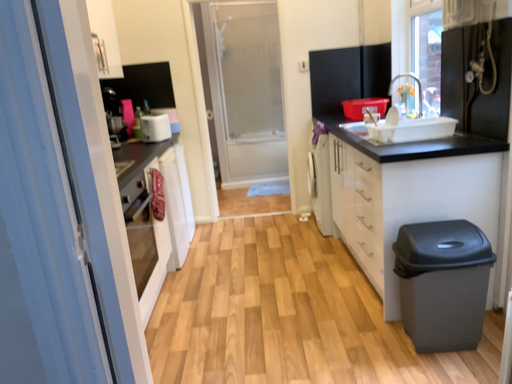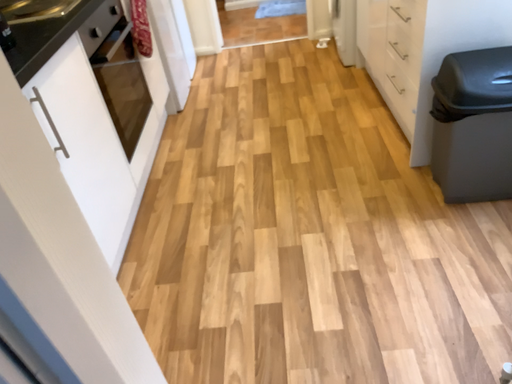
Question: Which way did the camera rotate in the video?

Choices:
 (A) rotated upward
 (B) rotated downward

Answer: (B)